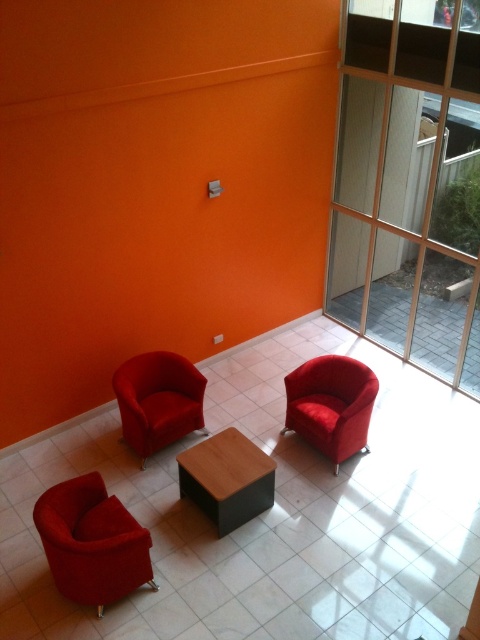
You are a delivery person carrying a package that is 1.2 meters wide. You need to exit the room through the transparent glass door at upper right. Can the package fit through the door if the velvet red armchair at lower left is blocking the doorway?

The transparent glass door at upper right is wider than the velvet red armchair at lower left. Since the package is 1.2 meters wide and the door is wider than the chair, the package can fit through the door if there is enough space around the chair.